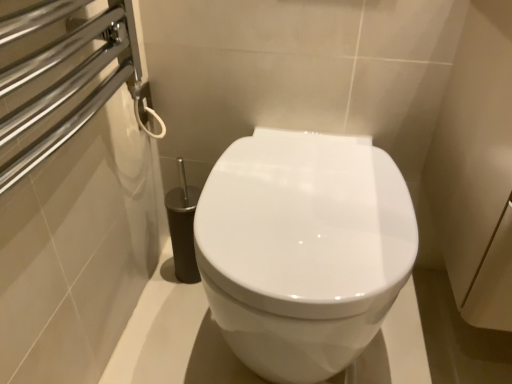
In order to face white glossy toilet at center, should I rotate leftwards or rightwards?

You should look right and rotate roughly 5.622 degrees.

The width and height of the screenshot is (512, 384). Describe the element at coordinates (303, 249) in the screenshot. I see `white glossy toilet at center` at that location.

Find the location of a particular element. The height and width of the screenshot is (384, 512). white glossy toilet at center is located at coordinates (303, 249).

Identify the location of white glossy toilet at center. click(303, 249).